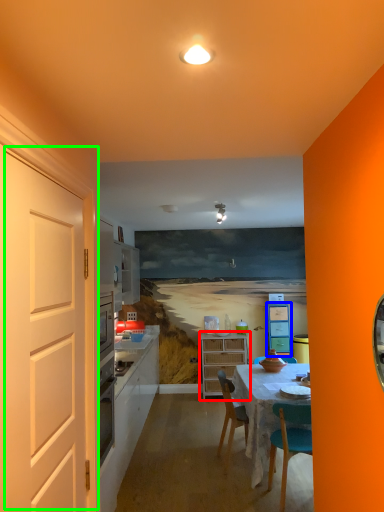
Question: Which object is positioned closest to cabinetry (highlighted by a red box)? Select from cabinetry (highlighted by a blue box) and door (highlighted by a green box).

Choices:
 (A) cabinetry
 (B) door

Answer: (A)